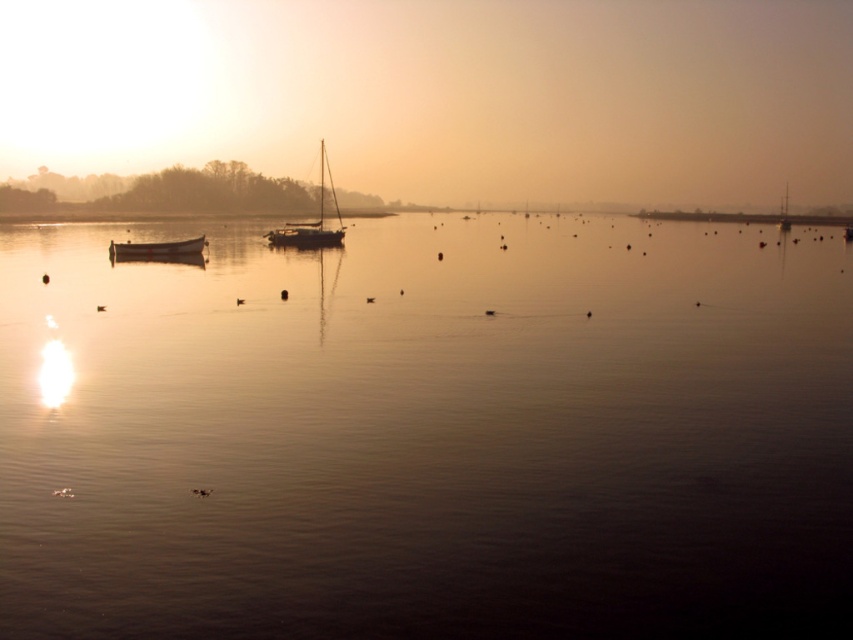
Based on the photo, you are standing at the center of the image and want to locate the smooth water at center. According to the coordinates provided, in which direction should you look to find it?

The smooth water at center is located at coordinates point (428, 435), so you should look slightly to the right from the center point to find it.